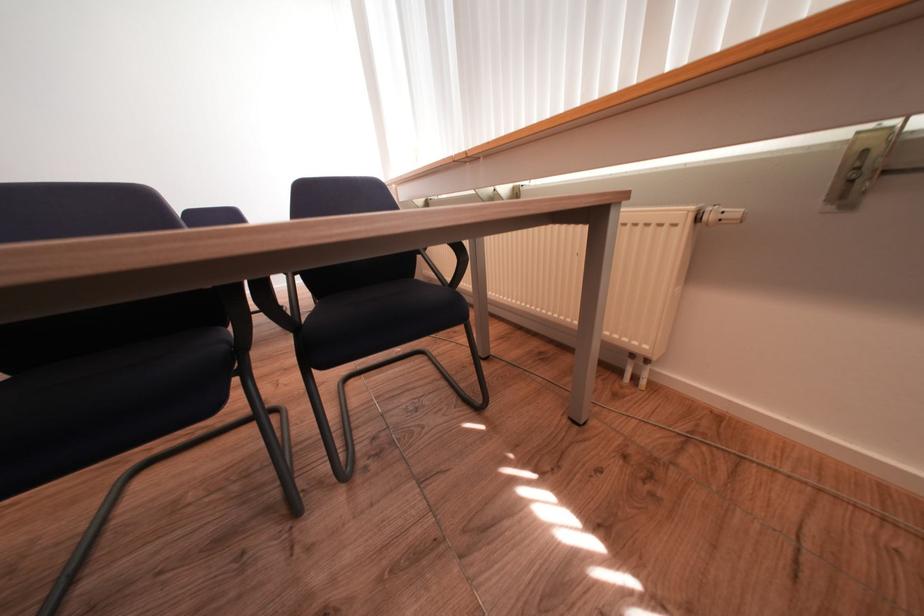
This screenshot has width=924, height=616. What do you see at coordinates (859, 167) in the screenshot?
I see `the metal table latch` at bounding box center [859, 167].